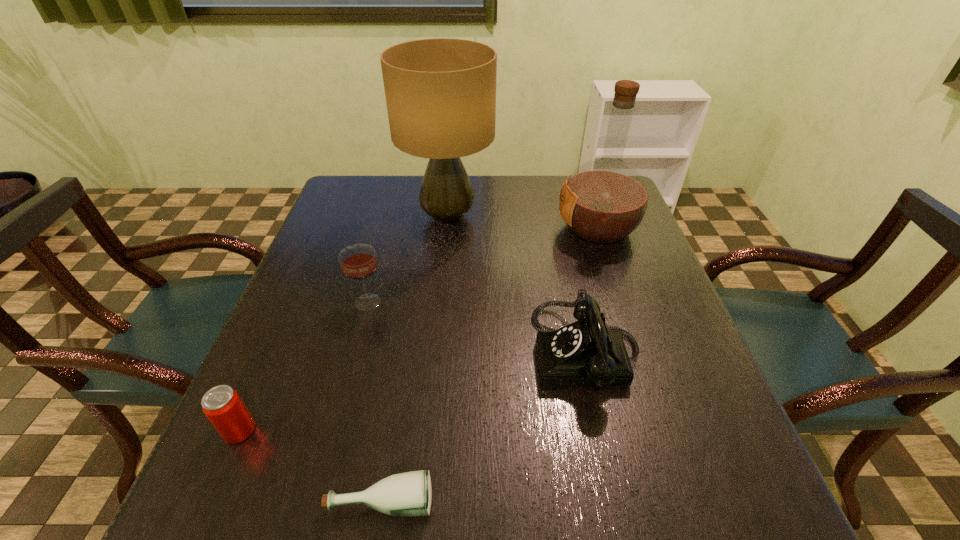
This screenshot has height=540, width=960. Find the location of `lampshade`. lampshade is located at coordinates (440, 93).

At what (x,y) coordinates should I click in order to perform the action: click on liquor. Please return your answer as a coordinate pair (x, y). The width and height of the screenshot is (960, 540). Looking at the image, I should click on (603, 201).

This screenshot has width=960, height=540. I want to click on wineglass, so click(x=358, y=262).

Identify the location of telephone. The height and width of the screenshot is (540, 960). click(588, 352).

At what (x,y) coordinates should I click in order to perform the action: click on the second shortest object. Please return your answer as a coordinate pair (x, y). This screenshot has height=540, width=960. Looking at the image, I should click on (222, 405).

The image size is (960, 540). Find the location of `the fifth farthest object`. the fifth farthest object is located at coordinates (222, 405).

Identify the location of bottle. Image resolution: width=960 pixels, height=540 pixels. (406, 494).

Find the location of `the nearest object`. the nearest object is located at coordinates [406, 494].

Where is `vacant region located on the front of the lampshade`? vacant region located on the front of the lampshade is located at coordinates (436, 346).

Where is `vacant space located 0.060m on the front label of the liquor`? vacant space located 0.060m on the front label of the liquor is located at coordinates (534, 228).